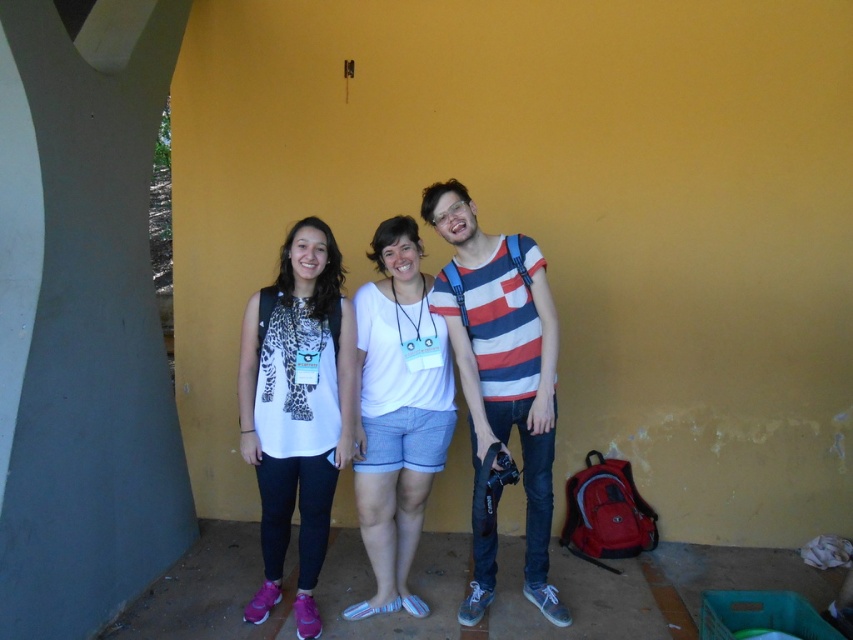
Question: Considering the relative positions of white matte shirt at center and white cotton shirt at center in the image provided, where is white matte shirt at center located with respect to white cotton shirt at center?

Choices:
 (A) above
 (B) below

Answer: (B)

Question: Does striped cotton shirt at center appear on the right side of white cotton shirt at center?

Choices:
 (A) yes
 (B) no

Answer: (A)

Question: Estimate the real-world distances between objects in this image. Which object is closer to the striped cotton shirt at center?

Choices:
 (A) white matte shirt at center
 (B) white cotton shirt at center

Answer: (B)

Question: Does white matte shirt at center appear on the left side of striped cotton shirt at center?

Choices:
 (A) yes
 (B) no

Answer: (A)

Question: Which point appears farthest from the camera in this image?

Choices:
 (A) (515, 282)
 (B) (374, 291)

Answer: (B)

Question: Considering the real-world distances, which object is farthest from the white cotton shirt at center?

Choices:
 (A) striped cotton shirt at center
 (B) white matte shirt at center

Answer: (A)